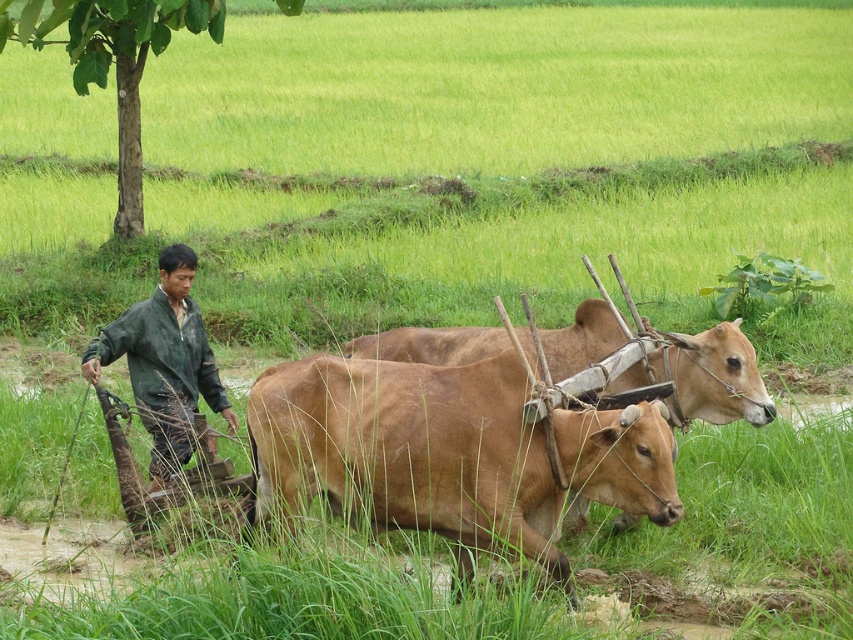
You are a farmer standing in the field and you need to decide which item to move first. The brown smooth cow at center and the green matte jacket at left are both in your way. Which one should you move first if you want to pass through the narrow path between them?

The green matte jacket at left should be moved first because the brown smooth cow at center is larger and harder to move quickly. Since the path is narrow, moving the smaller obstacle first would be more efficient.